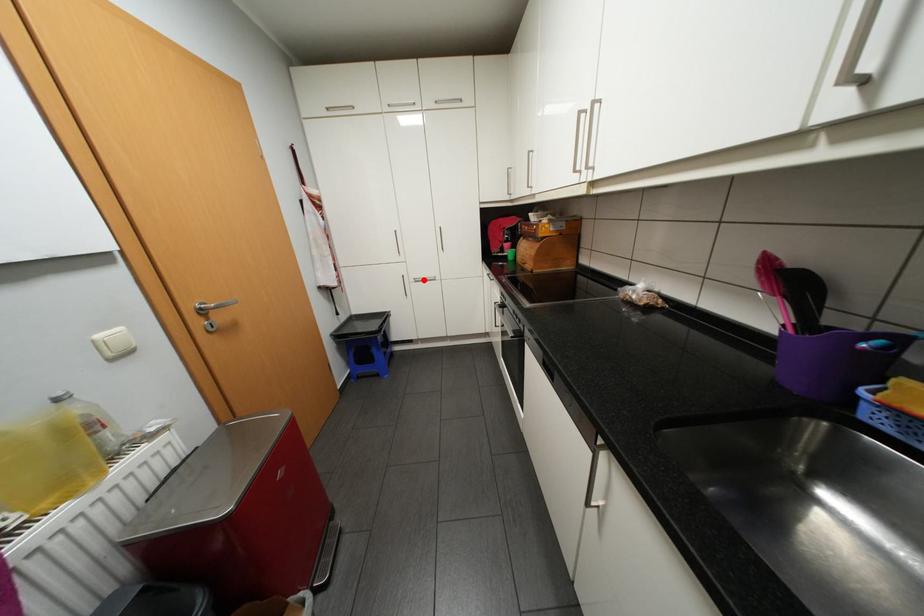
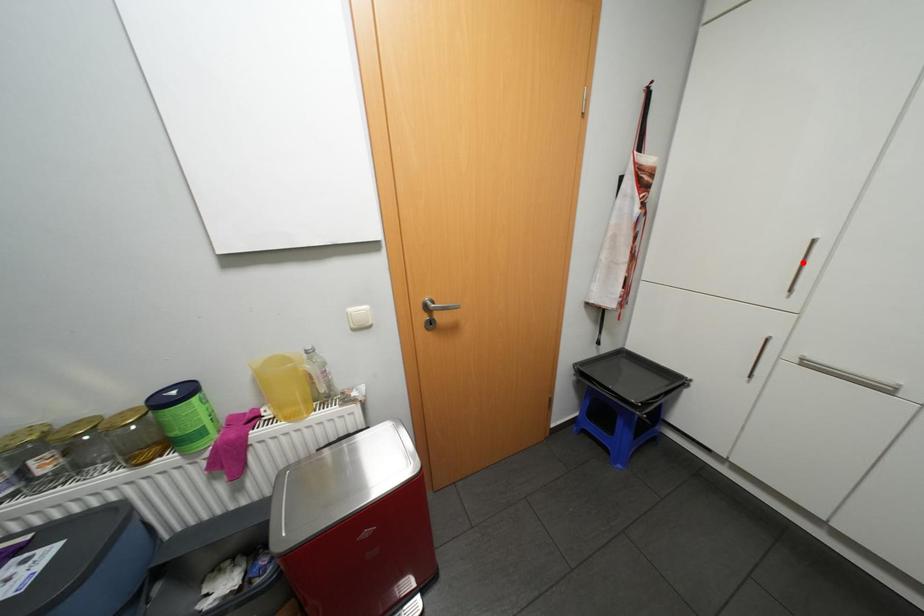
I am providing you with two images of the same scene from different viewpoints. A red point is marked on the first image and another point is marked on the second image. Does the point marked in image1 correspond to the same location as the one in image2?

No